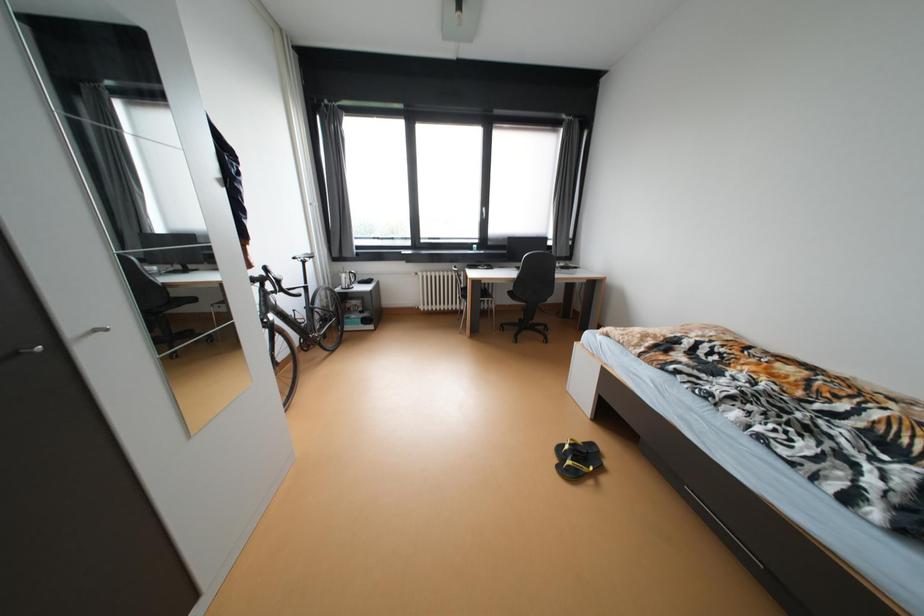
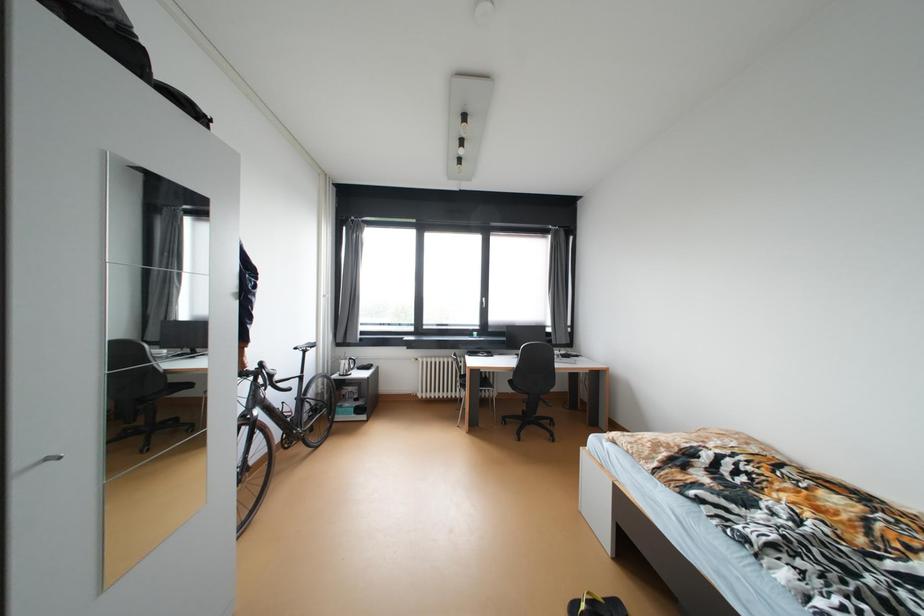
Question: How did the camera likely rotate?

Choices:
 (A) Left
 (B) Right
 (C) Up
 (D) Down

Answer: (C)